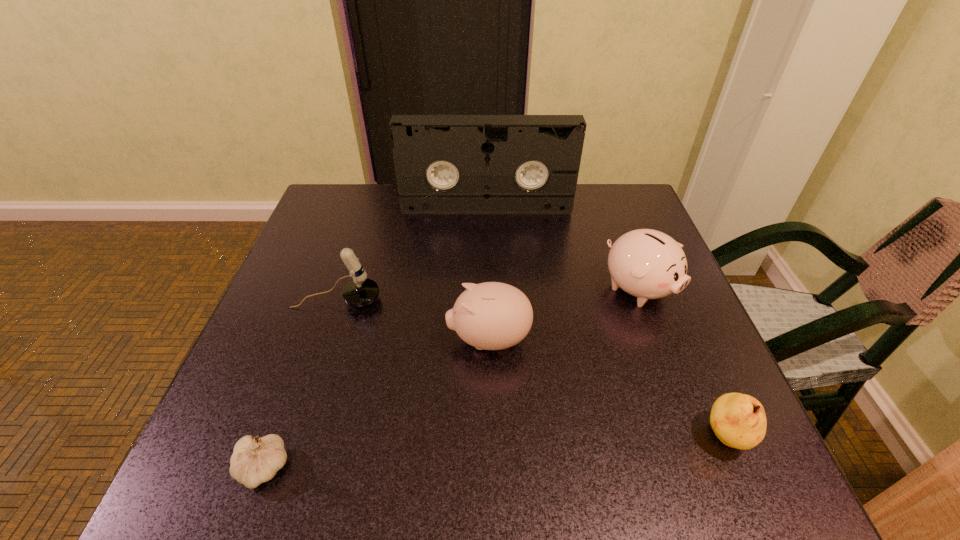
The image size is (960, 540). Identify the location of free spot located 0.170m at the snout of the left piggy bank. (362, 340).

Identify the location of vacant space located at the snout of the left piggy bank. Image resolution: width=960 pixels, height=540 pixels. (252, 340).

You are a GUI agent. You are given a task and a screenshot of the screen. Output one action in this format:
    pyautogui.click(x=<x>, y=<y>)
    Task: Click on the free region located 0.150m at the snout of the left piggy bank
    
    Given the screenshot: What is the action you would take?
    pyautogui.click(x=372, y=340)

At what (x,y) coordinates should I click in order to perform the action: click on free space located 0.210m on the back of the pear. Please return your answer as a coordinate pair (x, y). The image size is (960, 540). Looking at the image, I should click on click(x=677, y=322).

Where is `blank space located 0.280m on the right of the garlic`? The width and height of the screenshot is (960, 540). blank space located 0.280m on the right of the garlic is located at coordinates (468, 468).

The image size is (960, 540). Find the location of `object present at the far edge`. object present at the far edge is located at coordinates (445, 164).

Image resolution: width=960 pixels, height=540 pixels. I want to click on pear located in the near edge section of the desktop, so click(739, 421).

This screenshot has height=540, width=960. I want to click on garlic located at the near edge, so click(253, 462).

The width and height of the screenshot is (960, 540). Identify the location of microphone located in the left edge section of the desktop. (361, 291).

Locate an element on the screen. garlic located at the left edge is located at coordinates (253, 462).